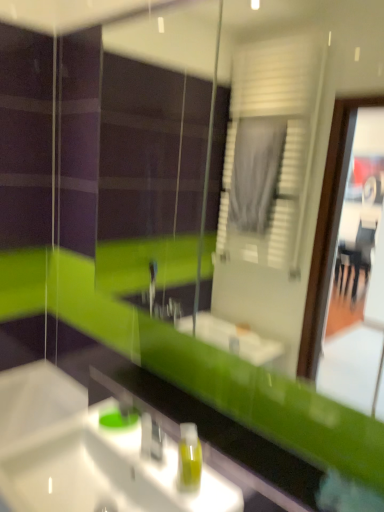
Where is `vacant space situated on the left part of teal glass soap dispenser at center`? The image size is (384, 512). vacant space situated on the left part of teal glass soap dispenser at center is located at coordinates (88, 418).